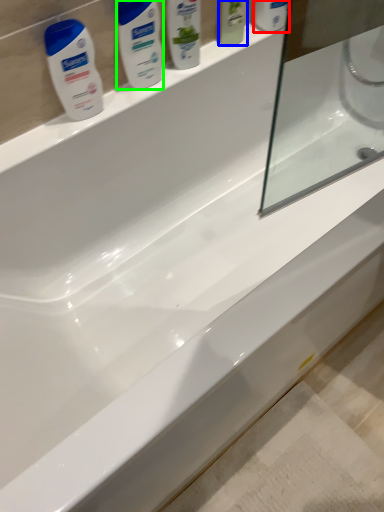
Question: Which object is the farthest from mouthwash (highlighted by a red box)? Choose among these: mouthwash (highlighted by a blue box) or personal care (highlighted by a green box).

Choices:
 (A) mouthwash
 (B) personal care

Answer: (B)